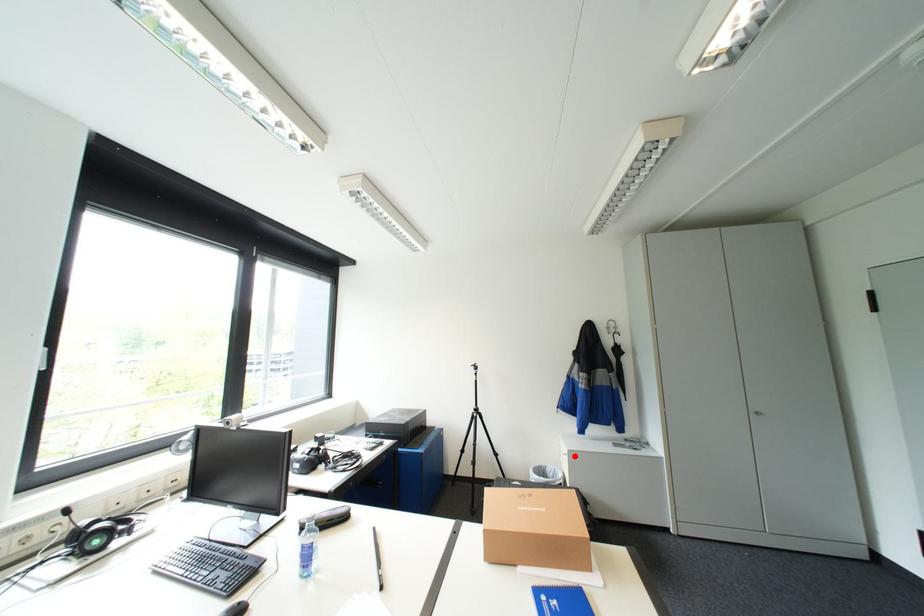
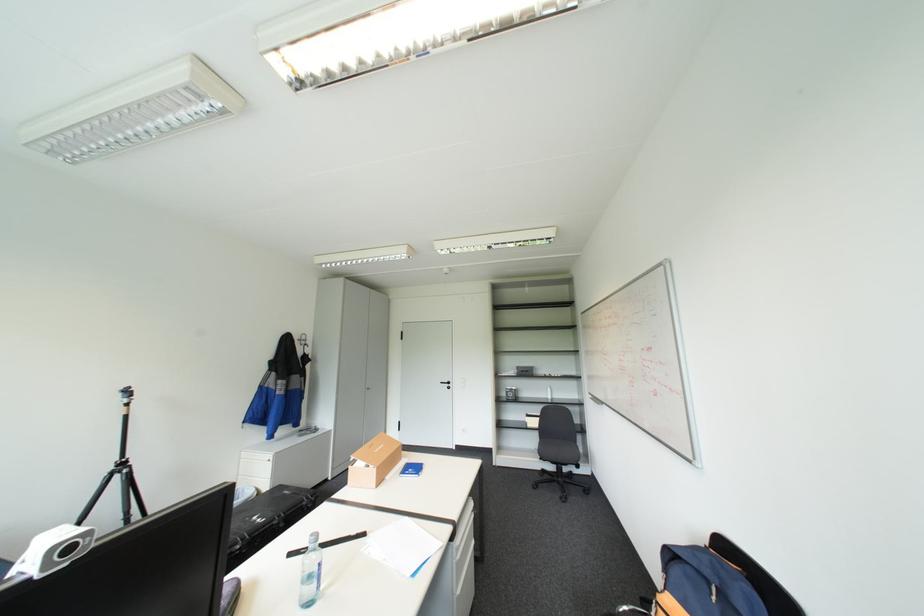
In the second image, find the point that corresponds to the highlighted location in the first image.

(278, 461)